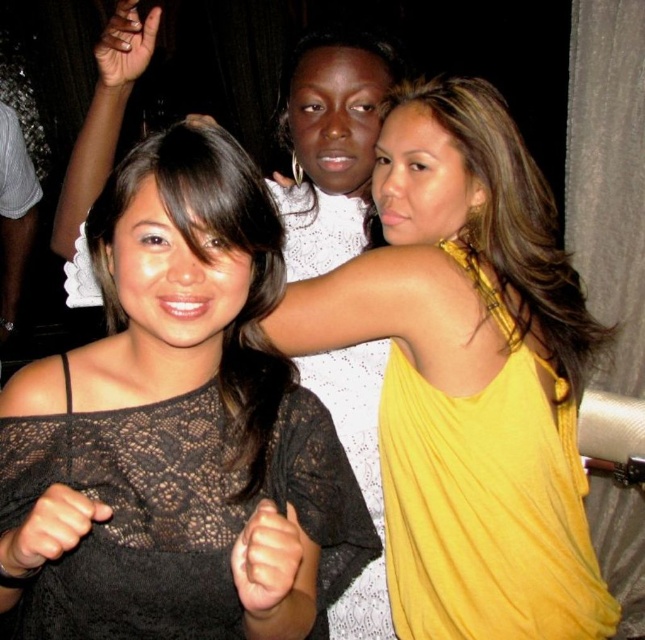
Is yellow satin dress at center closer to camera compared to white lace dress at center?

Yes, it is in front of white lace dress at center.

Between yellow satin dress at center and white lace dress at center, which one appears on the left side from the viewer's perspective?

Positioned to the left is white lace dress at center.

Between point (501, 227) and point (364, 458), which one is positioned behind?

The point (364, 458) is more distant.

Locate an element on the screen. This screenshot has height=640, width=645. yellow satin dress at center is located at coordinates (x=470, y=376).

Does point (192, 422) come in front of point (470, 438)?

Yes, point (192, 422) is in front of point (470, 438).

Looking at this image, who is positioned more to the left, black lace top at center or yellow satin dress at center?

Positioned to the left is black lace top at center.

The width and height of the screenshot is (645, 640). What do you see at coordinates (175, 429) in the screenshot? I see `black lace top at center` at bounding box center [175, 429].

The height and width of the screenshot is (640, 645). Identify the location of black lace top at center. pyautogui.click(x=175, y=429).

Which is below, black lace top at center or yellow silky dress at upper right?

Positioned lower is yellow silky dress at upper right.

Looking at this image, does black lace top at center have a greater width compared to yellow silky dress at upper right?

Yes, black lace top at center is wider than yellow silky dress at upper right.

You are a GUI agent. You are given a task and a screenshot of the screen. Output one action in this format:
    pyautogui.click(x=<x>, y=<y>)
    Task: Click on the black lace top at center
    Image resolution: width=645 pixels, height=640 pixels.
    Given the screenshot: What is the action you would take?
    pyautogui.click(x=175, y=429)